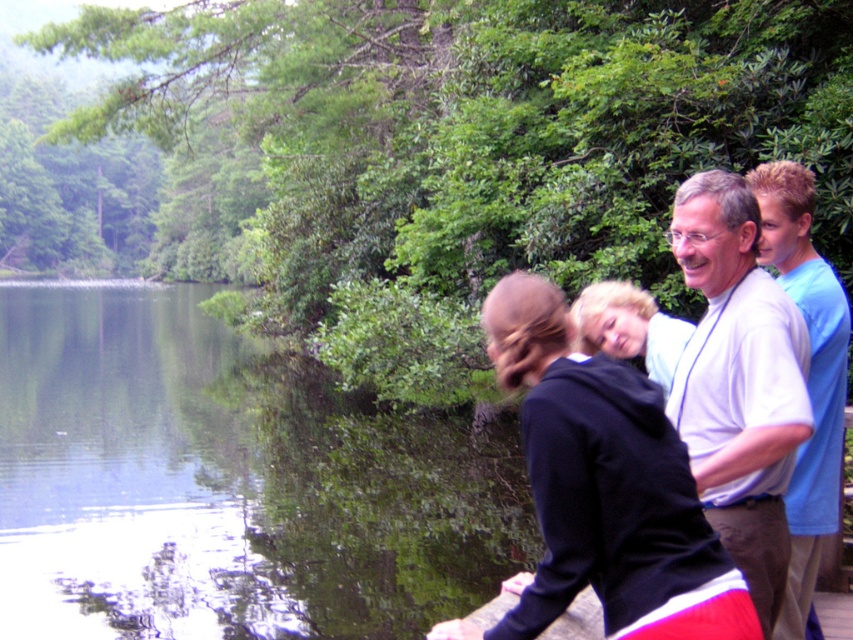
Does white cotton shirt at upper right lie in front of blue cotton shirt at right?

Yes, white cotton shirt at upper right is closer to the viewer.

Does white cotton shirt at upper right appear on the left side of blue cotton shirt at right?

Indeed, white cotton shirt at upper right is positioned on the left side of blue cotton shirt at right.

Where is `white cotton shirt at upper right`? This screenshot has width=853, height=640. white cotton shirt at upper right is located at coordinates (738, 381).

Does point (520, 330) come in front of point (816, 429)?

Yes, point (520, 330) is in front of point (816, 429).

At what (x,y) coordinates should I click in order to perform the action: click on black hoodie at center. Please return your answer as a coordinate pair (x, y). Looking at the image, I should click on (602, 490).

Consider the image. Who is shorter, black hoodie at center or white cotton shirt at upper right?

With less height is black hoodie at center.

Does point (546, 483) lie in front of point (763, 298)?

That is True.

Measure the distance between black hoodie at center and camera.

The distance of black hoodie at center from camera is 2.09 meters.

Identify the location of black hoodie at center. The width and height of the screenshot is (853, 640). (602, 490).